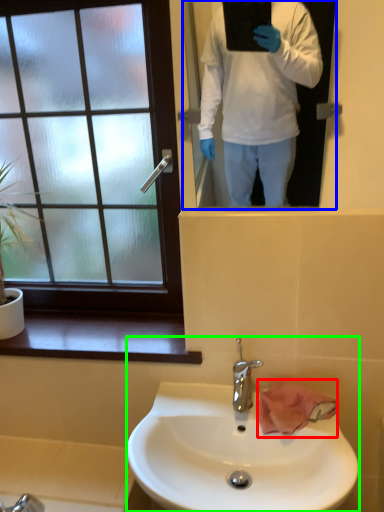
Question: Estimate the real-world distances between objects in this image. Which object is closer to hand towel (highlighted by a red box), mirror (highlighted by a blue box) or sink (highlighted by a green box)?

Choices:
 (A) mirror
 (B) sink

Answer: (B)